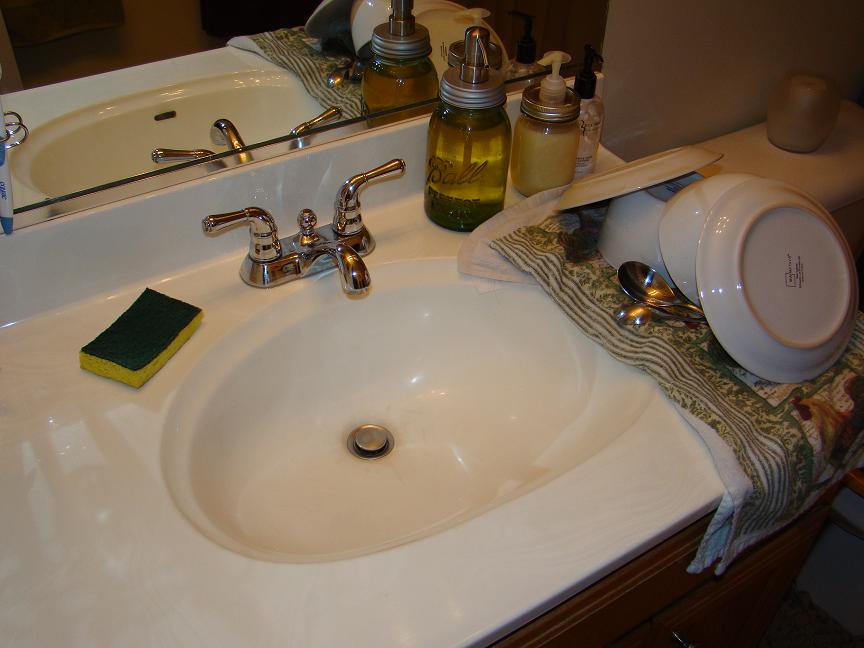
Image resolution: width=864 pixels, height=648 pixels. Identify the location of dishes. (702, 243).